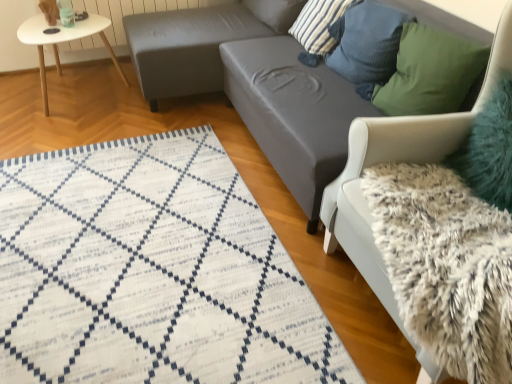
Question: Does white glossy table at upper left have a smaller size compared to white woven mat at lower left?

Choices:
 (A) yes
 (B) no

Answer: (B)

Question: Does white glossy table at upper left turn towards white woven mat at lower left?

Choices:
 (A) yes
 (B) no

Answer: (A)

Question: Is white glossy table at upper left wider than white woven mat at lower left?

Choices:
 (A) yes
 (B) no

Answer: (B)

Question: Is the surface of white glossy table at upper left in direct contact with white woven mat at lower left?

Choices:
 (A) yes
 (B) no

Answer: (B)

Question: Can you confirm if white glossy table at upper left is bigger than white woven mat at lower left?

Choices:
 (A) no
 (B) yes

Answer: (B)

Question: In the image, is teal glass at upper left on the left side or the right side of striped fabric pillow at upper right, acting as the fourth pillow starting from the front?

Choices:
 (A) right
 (B) left

Answer: (B)

Question: Is point (67, 11) closer or farther from the camera than point (325, 24)?

Choices:
 (A) closer
 (B) farther

Answer: (B)

Question: Looking at the image, does teal glass at upper left seem bigger or smaller compared to striped fabric pillow at upper right, acting as the fourth pillow starting from the front?

Choices:
 (A) big
 (B) small

Answer: (B)

Question: From a real-world perspective, is teal glass at upper left above or below striped fabric pillow at upper right, the 2th pillow when ordered from back to front?

Choices:
 (A) below
 (B) above

Answer: (A)

Question: Looking at the image, does striped fabric pillow at upper center, which ranks as the fifth pillow in front-to-back order, seem bigger or smaller compared to white woven mat at lower left?

Choices:
 (A) small
 (B) big

Answer: (A)

Question: Does point (281, 21) appear closer or farther from the camera than point (50, 167)?

Choices:
 (A) closer
 (B) farther

Answer: (B)

Question: From a real-world perspective, is striped fabric pillow at upper center, which ranks as the fifth pillow in front-to-back order, physically located above or below white woven mat at lower left?

Choices:
 (A) below
 (B) above

Answer: (B)

Question: Would you say striped fabric pillow at upper center, which is the 1th pillow from back to front, is to the left or to the right of white woven mat at lower left in the picture?

Choices:
 (A) left
 (B) right

Answer: (B)

Question: Is point (508, 160) positioned closer to the camera than point (89, 34)?

Choices:
 (A) closer
 (B) farther

Answer: (A)

Question: Do you think teal fuzzy pillow at upper right, the fifth pillow when ordered from back to front, is within white glossy table at upper left, or outside of it?

Choices:
 (A) inside
 (B) outside

Answer: (B)